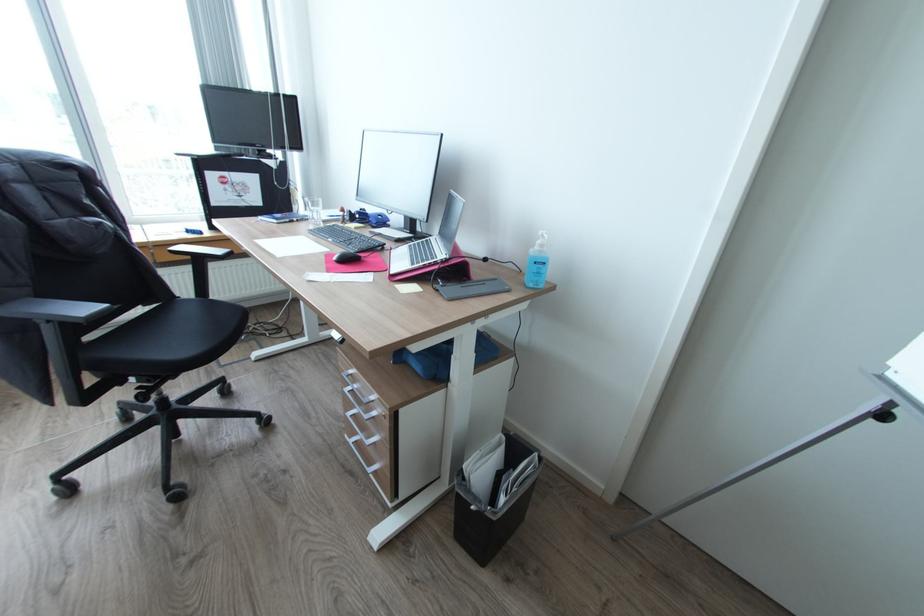
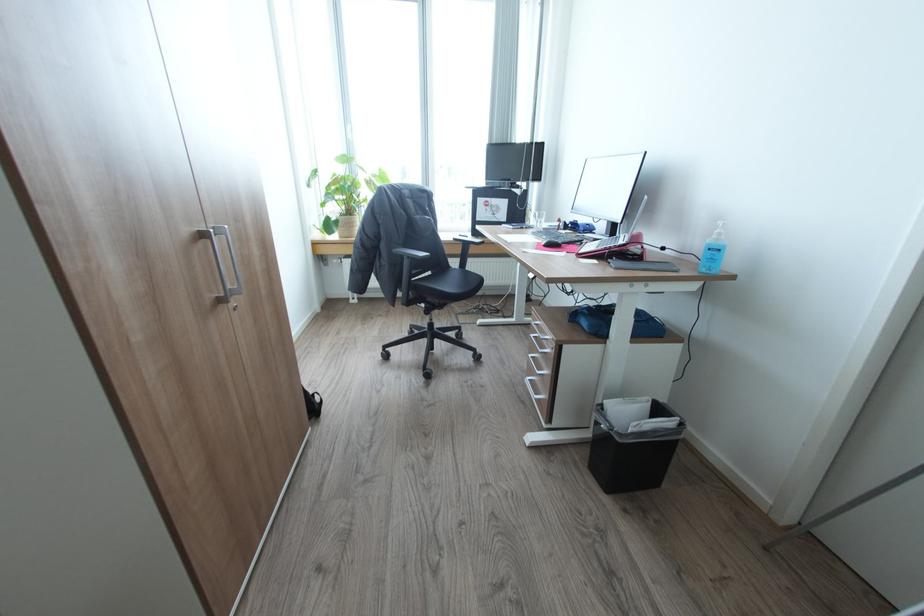
Question: How did the camera likely rotate?

Choices:
 (A) Left
 (B) Right
 (C) Up
 (D) Down

Answer: (A)